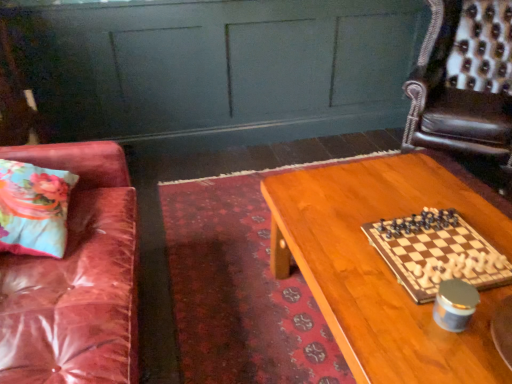
This screenshot has height=384, width=512. I want to click on space that is in front of matte green dresser at upper center, so click(216, 213).